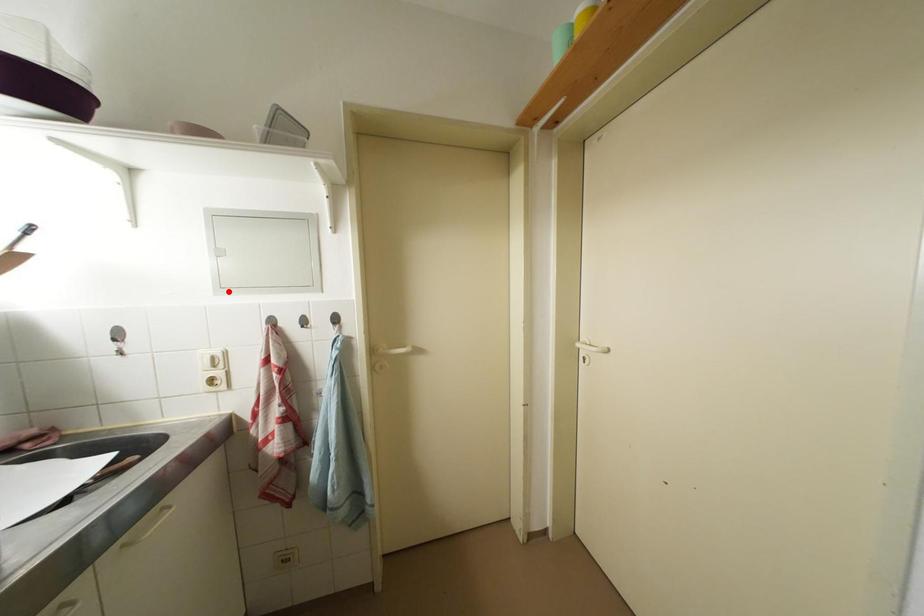
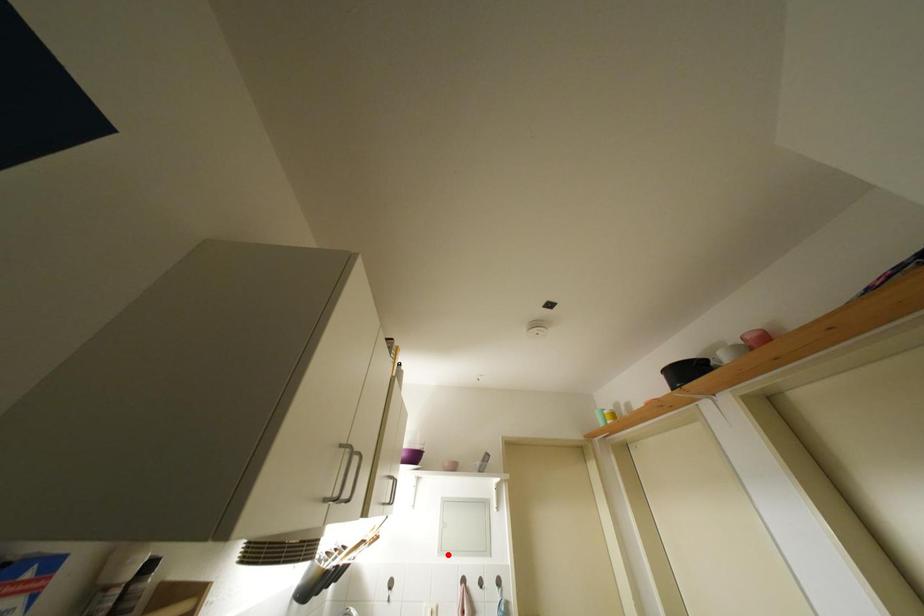
I am providing you with two images of the same scene from different viewpoints. A red point is marked on the first image and another point is marked on the second image. Are the points marked in image1 and image2 representing the same 3D position?

Yes